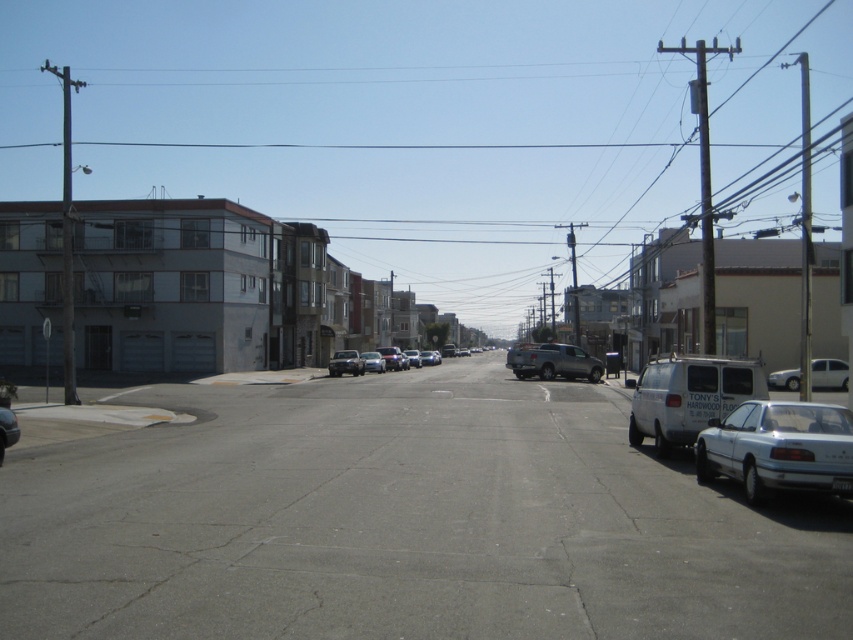
You are standing at the camera position looking at the urban street scene. There are two points marked on the road ahead. The first point is at coordinates point [819,470] and the second is at point [816,371]. Which point is closer to your current position?

Point [819,470] is closer to the camera than point [816,371], so the first point is closer to your current position.

You are a delivery driver who needs to park your truck between the silver metallic sedan at lower right and the white matte sedan at right. Can you fit your truck which is 6 meters long in that space?

The silver metallic sedan at lower right is bigger than the white matte sedan at right, but the exact distance between them isn not provided. Without knowing the available space, it is impossible to determine if the truck will fit.

You are a delivery driver who needs to park your vehicle in this area. You have a white matte van at lower right and a silver metallic truck at center. Which vehicle takes up less space in the parking spot?

The white matte van at lower right takes up less space in the parking spot because it has a smaller size compared to the silver metallic truck at center.